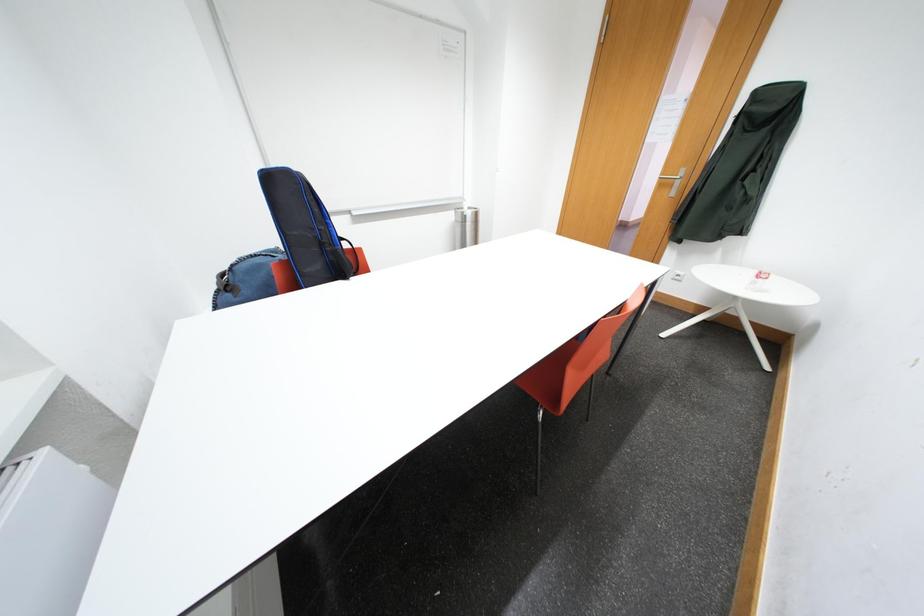
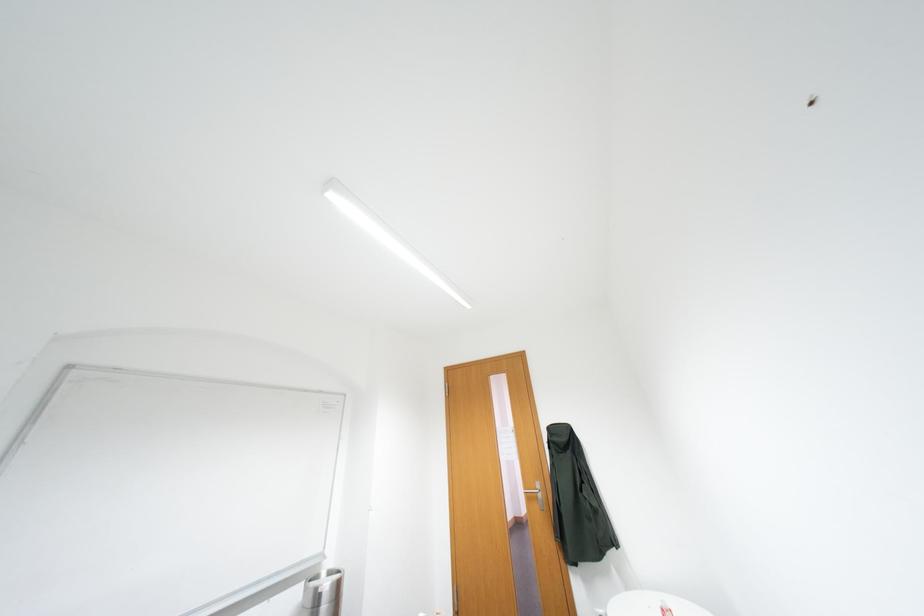
The images are taken continuously from a first-person perspective. In which direction is your viewpoint rotating?

The camera rotated toward right-up.